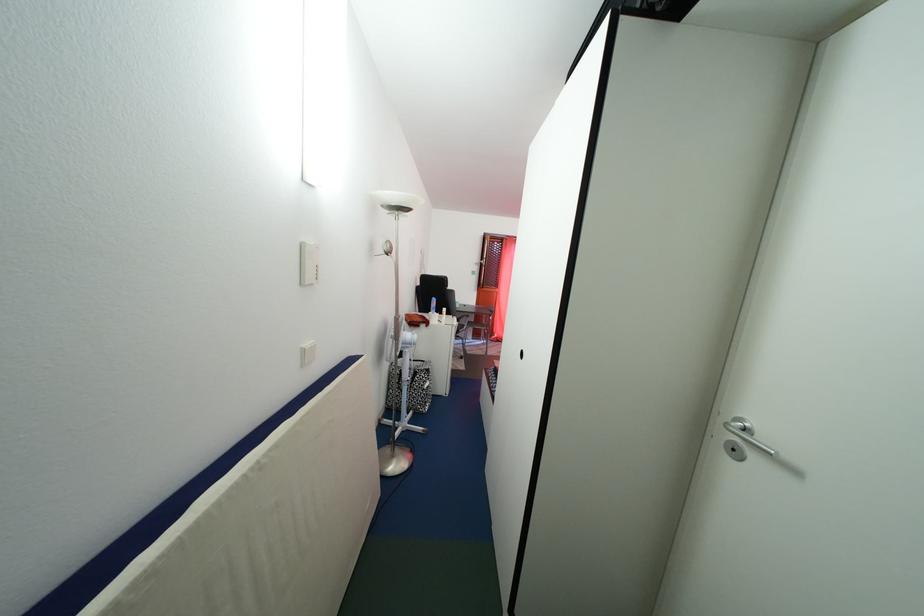
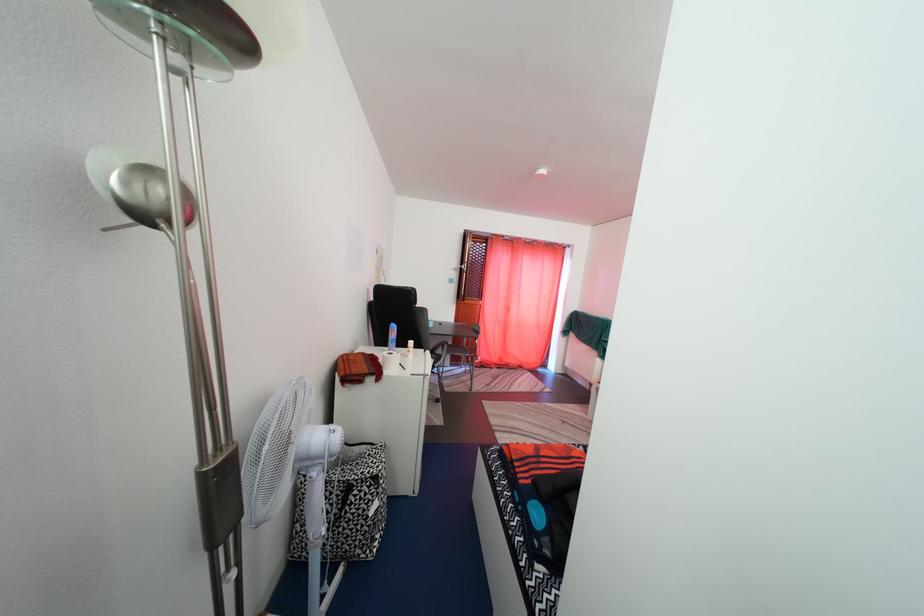
In the second image, find the point that corresponds to (470,329) in the first image.

(447, 359)